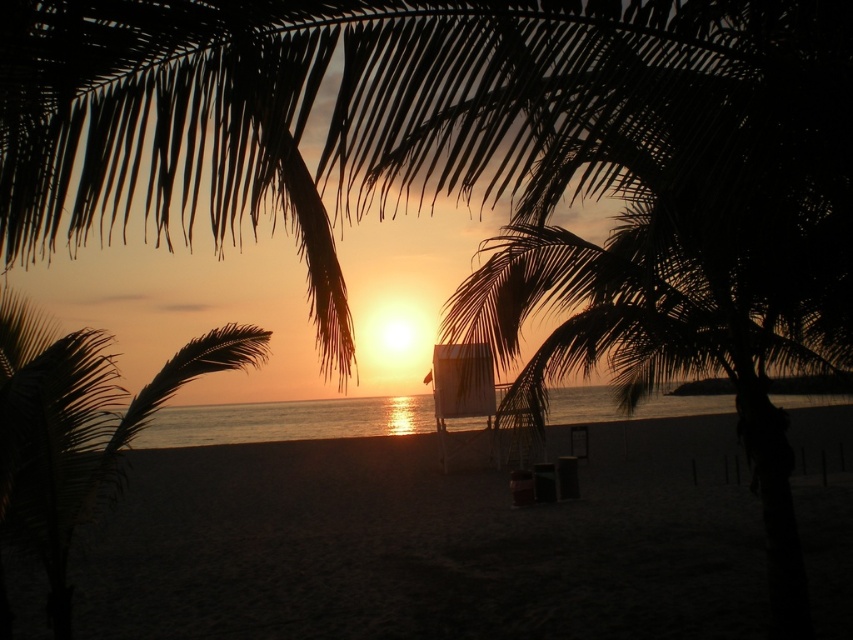
Which of these two, dark sand at center or dark brown leafy palm tree at lower left, stands taller?

dark brown leafy palm tree at lower left is taller.

Which is more to the left, dark sand at center or dark brown leafy palm tree at lower left?

From the viewer's perspective, dark brown leafy palm tree at lower left appears more on the left side.

This screenshot has width=853, height=640. I want to click on dark sand at center, so click(x=427, y=545).